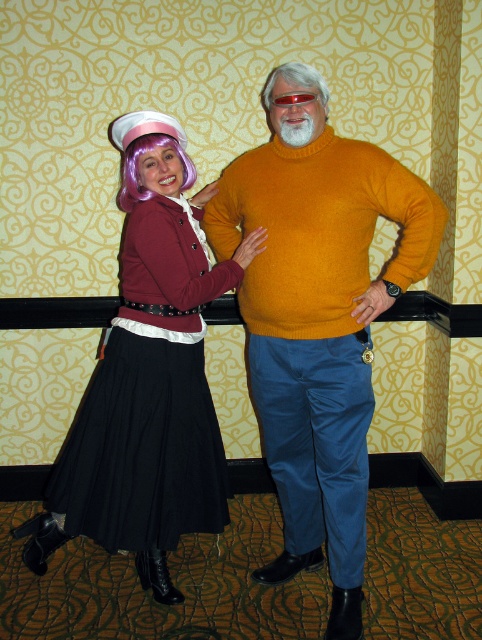
Who is taller, mustard yellow turtleneck sweater at center or shiny purple wig at center?

mustard yellow turtleneck sweater at center is taller.

Consider the image. Is mustard yellow turtleneck sweater at center below shiny purple wig at center?

Indeed, mustard yellow turtleneck sweater at center is positioned under shiny purple wig at center.

What do you see at coordinates (319, 324) in the screenshot? I see `mustard yellow turtleneck sweater at center` at bounding box center [319, 324].

You are a GUI agent. You are given a task and a screenshot of the screen. Output one action in this format:
    pyautogui.click(x=<x>, y=<y>)
    Task: Click on the mustard yellow turtleneck sweater at center
    The image size is (482, 640).
    Given the screenshot: What is the action you would take?
    pyautogui.click(x=319, y=324)

Describe the element at coordinates (319, 324) in the screenshot. The image size is (482, 640). I see `mustard yellow turtleneck sweater at center` at that location.

Is point (442, 214) closer to viewer compared to point (135, 381)?

Yes, point (442, 214) is closer to viewer.

Is point (395, 288) positioned in front of point (116, 344)?

Yes, it is in front of point (116, 344).

Locate an element on the screen. mustard yellow turtleneck sweater at center is located at coordinates (319, 324).

Between mustard yellow turtleneck sweater at center and red plastic goggles at center, which one is positioned lower?

mustard yellow turtleneck sweater at center

Does mustard yellow turtleneck sweater at center have a lesser width compared to red plastic goggles at center?

No, mustard yellow turtleneck sweater at center is not thinner than red plastic goggles at center.

Which is behind, point (285, 180) or point (294, 100)?

The point (285, 180) is behind.

Identify the location of mustard yellow turtleneck sweater at center. (319, 324).